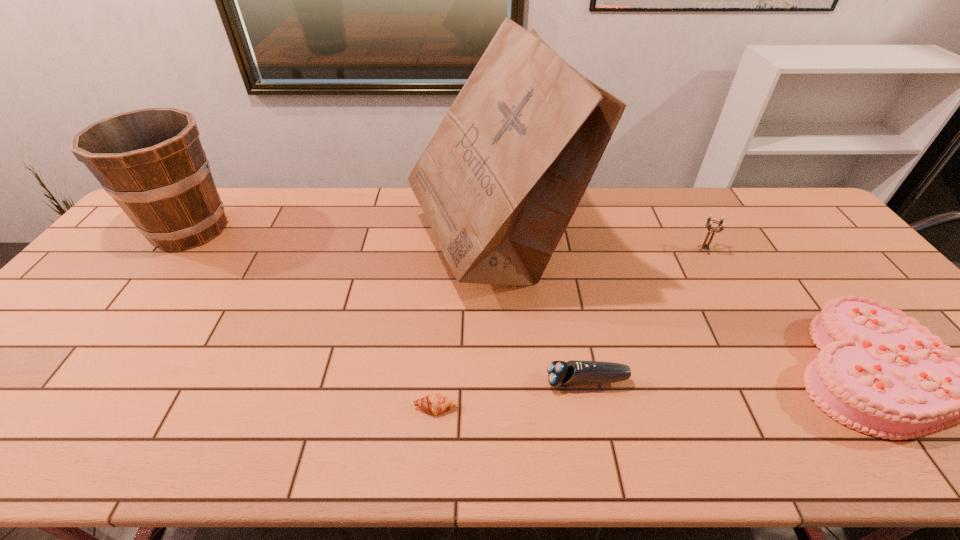
The width and height of the screenshot is (960, 540). Find the location of `vacant area situated 0.060m on the head of the electric shaver`. vacant area situated 0.060m on the head of the electric shaver is located at coordinates (520, 381).

Find the location of a particular element. This screenshot has height=540, width=960. free space located 0.230m on the head of the electric shaver is located at coordinates (446, 381).

You are a GUI agent. You are given a task and a screenshot of the screen. Output one action in this format:
    pyautogui.click(x=<x>, y=<y>)
    Task: Click on the free space located 0.280m on the head of the electric shaver
    
    Given the screenshot: What is the action you would take?
    pyautogui.click(x=424, y=381)

This screenshot has height=540, width=960. I want to click on grocery bag at the far edge, so click(x=501, y=178).

The width and height of the screenshot is (960, 540). I want to click on bucket located in the far edge section of the desktop, so click(x=151, y=161).

Locate an element on the screen. The image size is (960, 540). object located in the left edge section of the desktop is located at coordinates (151, 161).

I want to click on object present at the far left corner, so click(151, 161).

Locate an element on the screen. This screenshot has width=960, height=540. vacant space at the far edge of the desktop is located at coordinates (601, 219).

Where is `blank space at the near edge of the desktop`? The image size is (960, 540). blank space at the near edge of the desktop is located at coordinates (390, 447).

Locate an element on the screen. vacant space at the right edge of the desktop is located at coordinates (852, 280).